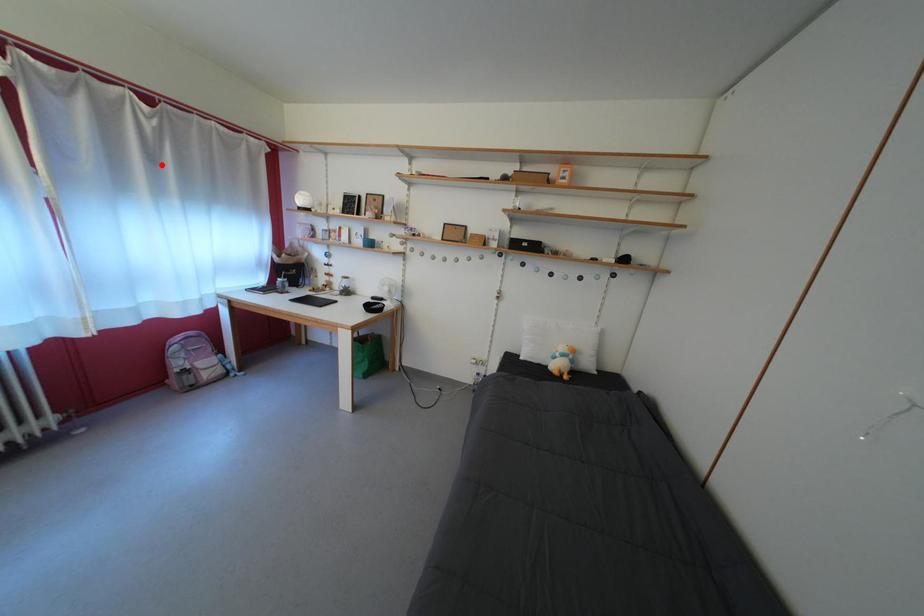
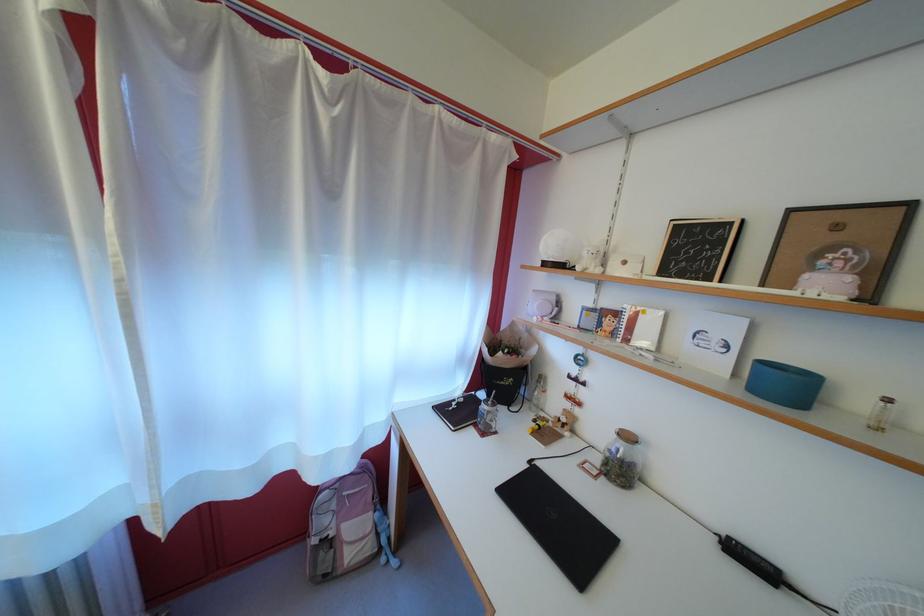
Locate, in the second image, the point that corresponds to the highlighted location in the first image.

(335, 193)